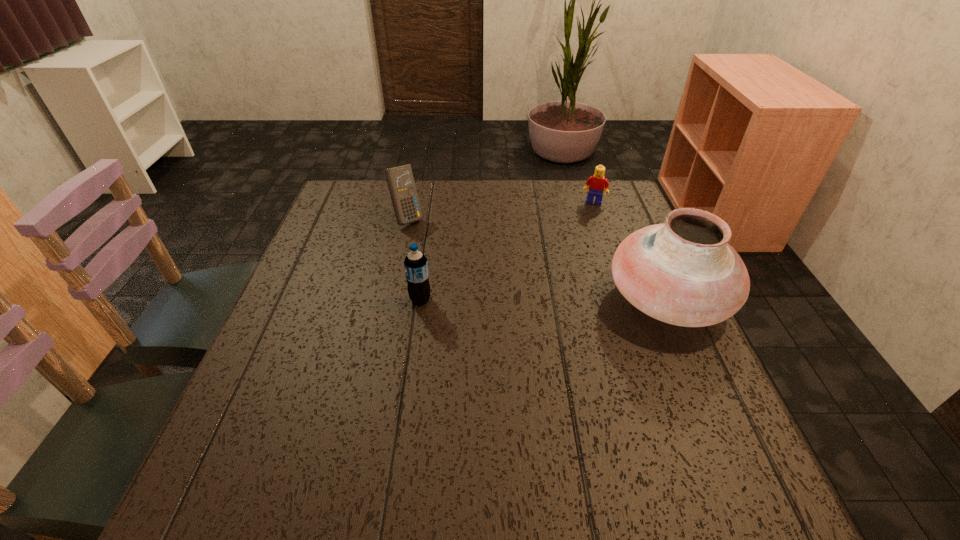
Where is `soda bottle`? This screenshot has height=540, width=960. soda bottle is located at coordinates (416, 265).

Find the location of a particular element. the tallest object is located at coordinates (683, 272).

Identify the location of Lego. (597, 183).

At what (x,y) coordinates should I click in order to perform the action: click on the shortest object. Please return your answer as a coordinate pair (x, y). Image resolution: width=960 pixels, height=540 pixels. Looking at the image, I should click on (597, 183).

The width and height of the screenshot is (960, 540). In order to click on calculator in this screenshot , I will do (x=400, y=180).

The width and height of the screenshot is (960, 540). I want to click on vacant space situated 0.140m on the left of the soda bottle, so click(348, 300).

This screenshot has height=540, width=960. What are the coordinates of `vacant region located on the left of the tallest object` in the screenshot? It's located at (481, 300).

Image resolution: width=960 pixels, height=540 pixels. I want to click on vacant space situated 0.150m on the face of the Lego, so click(585, 234).

Image resolution: width=960 pixels, height=540 pixels. In order to click on free location located 0.150m on the face of the Lego in this screenshot , I will do pos(585,234).

Identify the location of free spot located on the face of the Lego. (580, 254).